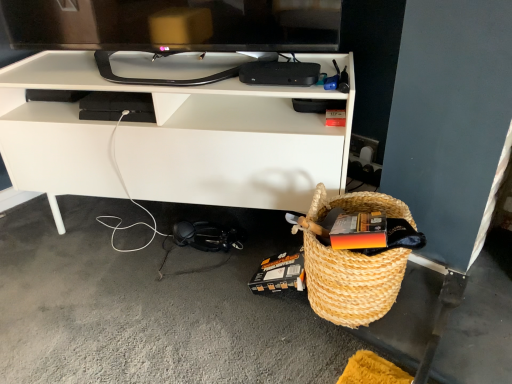
Identify the location of vacant space positioned to the left of natural woven picnic basket at lower right. (246, 326).